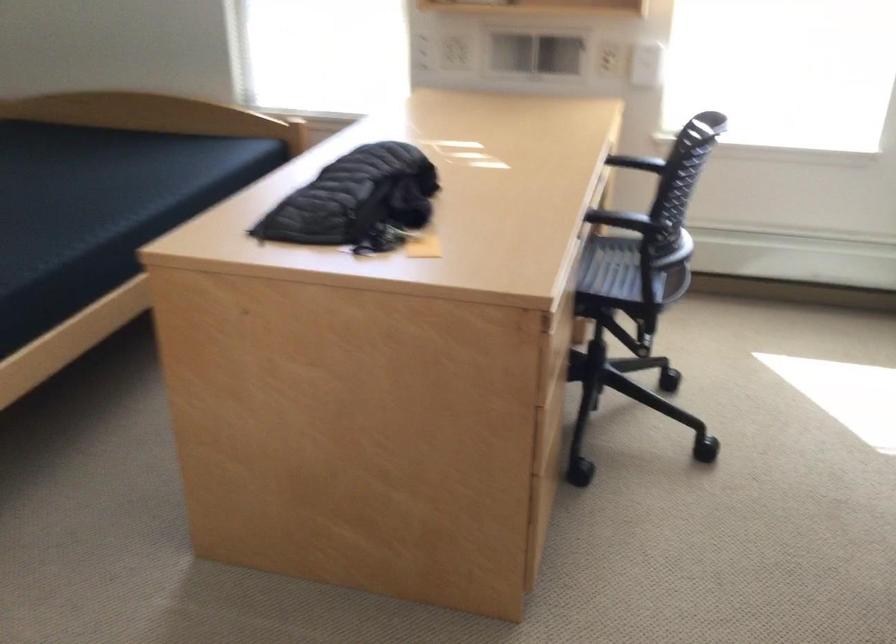
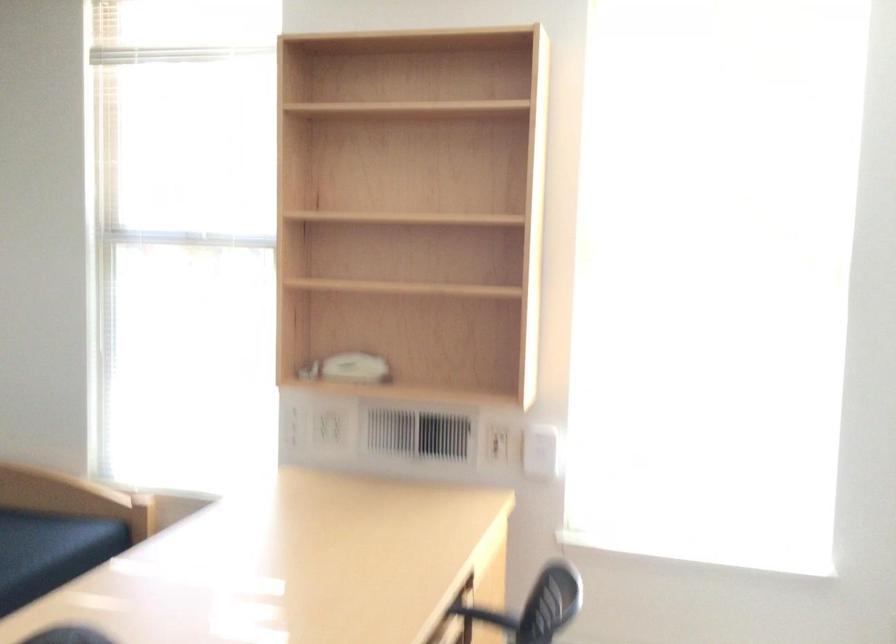
Question: Based on the continuous images, in which direction is the camera rotating? Reply with the corresponding letter.

Choices:
 (A) Left
 (B) Right
 (C) Up
 (D) Down

Answer: (C)